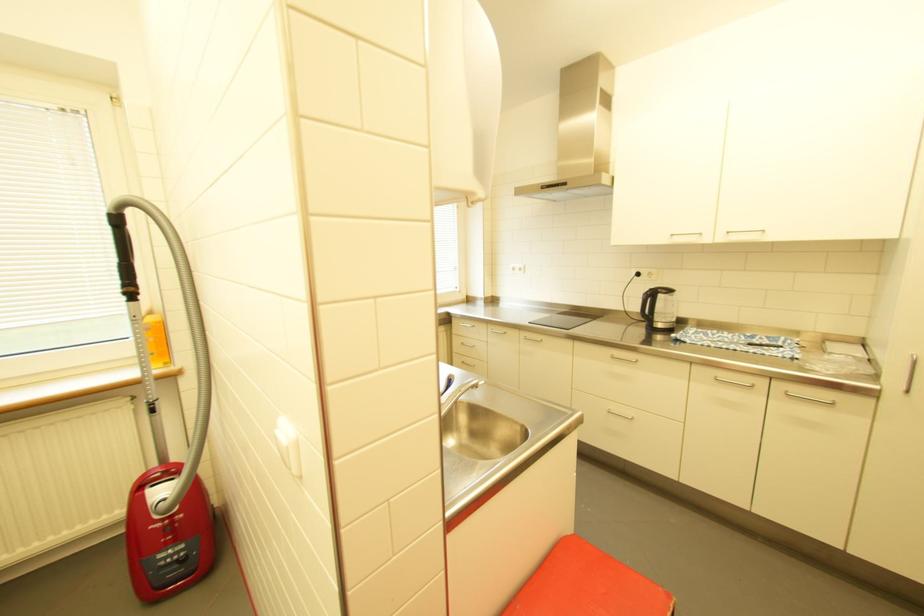
Where is `orange bottle`? orange bottle is located at coordinates (155, 339).